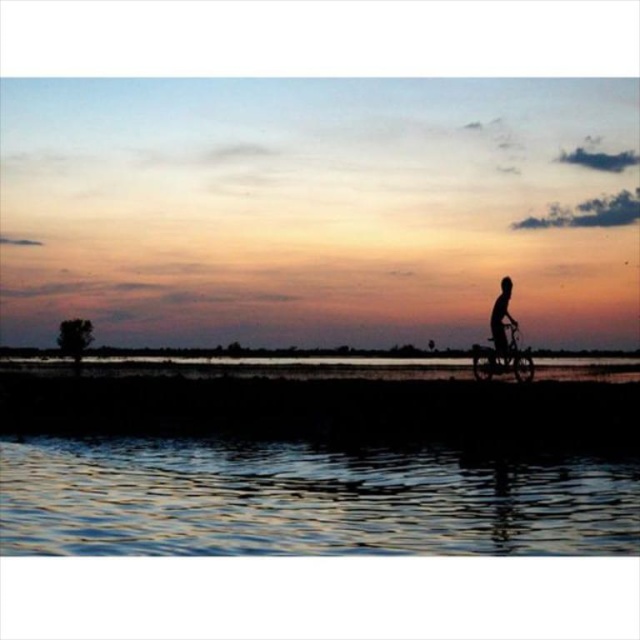
Is glistening water at lower center positioned before silhouette human at right?

Yes, it is.

Does glistening water at lower center have a lesser height compared to silhouette human at right?

Indeed, glistening water at lower center has a lesser height compared to silhouette human at right.

In order to click on glistening water at lower center in this screenshot , I will do `click(314, 465)`.

Where is `glistening water at lower center`? glistening water at lower center is located at coordinates (314, 465).

Between point (520, 376) and point (502, 339), which one is positioned behind?

Positioned behind is point (502, 339).

Does point (520, 362) come farther from viewer compared to point (502, 320)?

No.

Is point (477, 371) in front of point (509, 292)?

Yes, point (477, 371) is closer to viewer.

Locate an element on the screen. Image resolution: width=640 pixels, height=640 pixels. shiny metallic bicycle at right is located at coordinates (502, 358).

Who is positioned more to the right, glistening water at lower center or shiny metallic bicycle at right?

From the viewer's perspective, shiny metallic bicycle at right appears more on the right side.

Does glistening water at lower center appear over shiny metallic bicycle at right?

Incorrect, glistening water at lower center is not positioned above shiny metallic bicycle at right.

Who is more distant from viewer, [16,484] or [486,368]?

The point [486,368] is more distant.

Identify the location of glistening water at lower center. (314, 465).